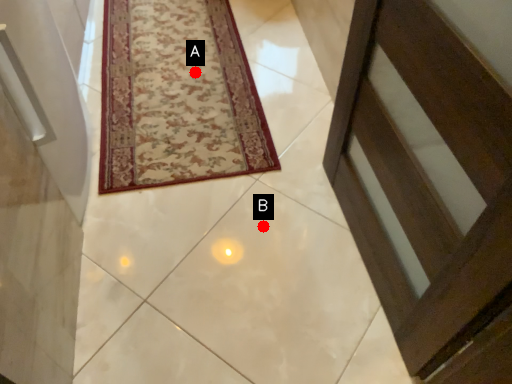
Question: Two points are circled on the image, labeled by A and B beside each circle. Which of the following is the closest to the observer?

Choices:
 (A) A is closer
 (B) B is closer

Answer: (B)